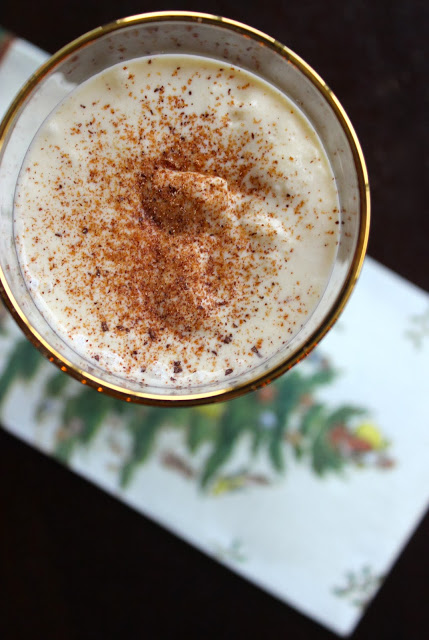
The image size is (429, 640). What are the coordinates of `gold trim` in the screenshot? It's located at (369, 228).